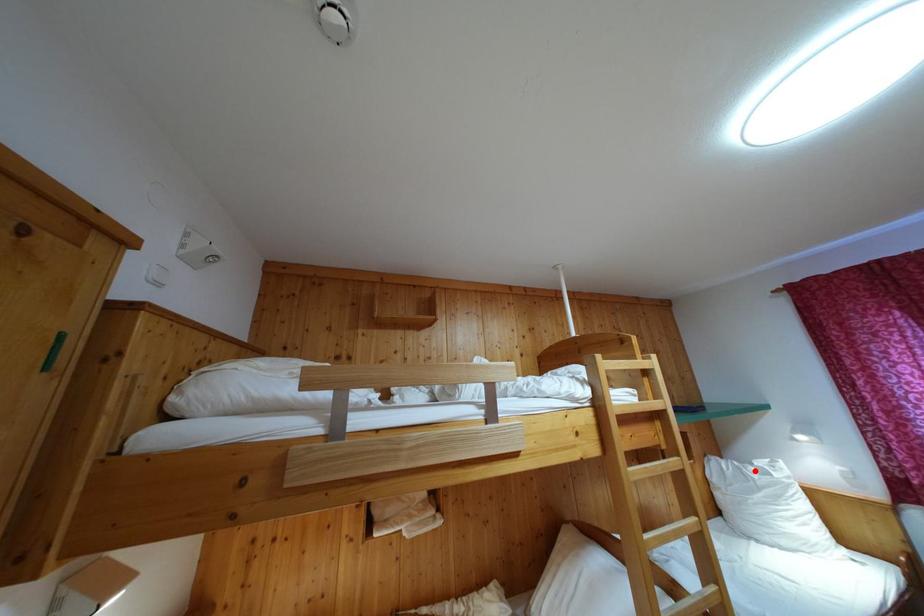
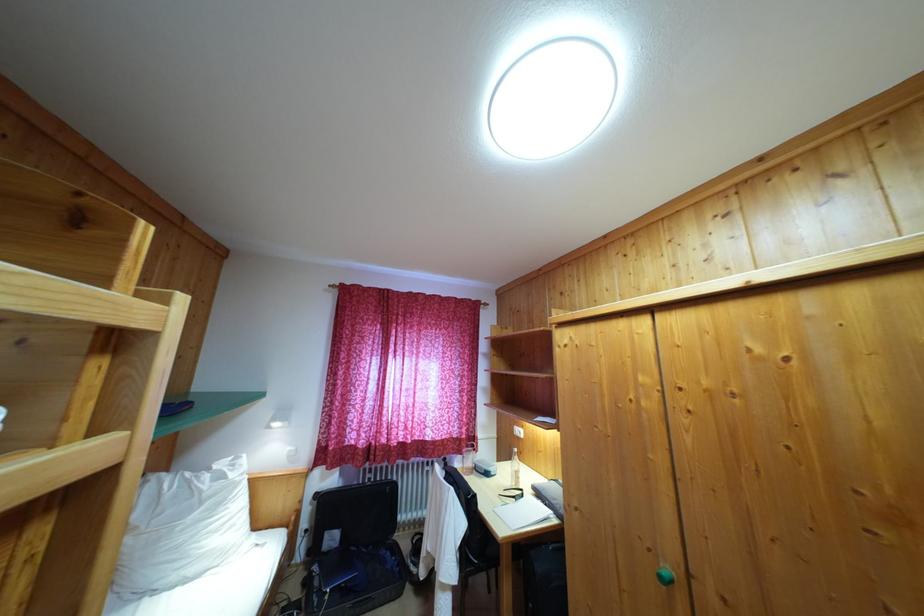
The point at the highlighted location is marked in the first image. Where is the corresponding point in the second image?

(213, 476)